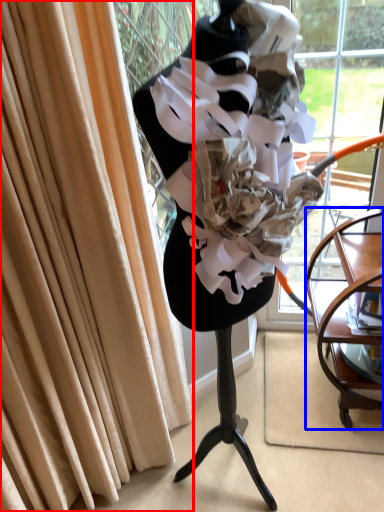
Question: Which object is closer to the camera taking this photo, curtain (highlighted by a red box) or furniture (highlighted by a blue box)?

Choices:
 (A) curtain
 (B) furniture

Answer: (A)